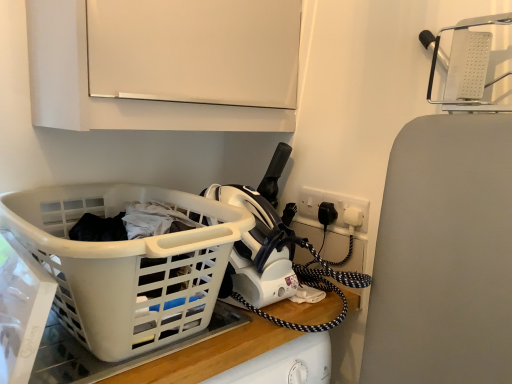
Question: In terms of width, does white matte cabinet at upper center look wider or thinner when compared to white plastic socket at upper right?

Choices:
 (A) wide
 (B) thin

Answer: (A)

Question: In the image, is white matte cabinet at upper center on the left side or the right side of white plastic socket at upper right?

Choices:
 (A) left
 (B) right

Answer: (A)

Question: Based on their relative distances, which object is farther from the white plastic laundry basket at lower left?

Choices:
 (A) white matte cabinet at upper center
 (B) white plastic socket at upper right

Answer: (B)

Question: Which is farther from the white plastic laundry basket at lower left?

Choices:
 (A) white matte cabinet at upper center
 (B) white plastic socket at upper right

Answer: (B)